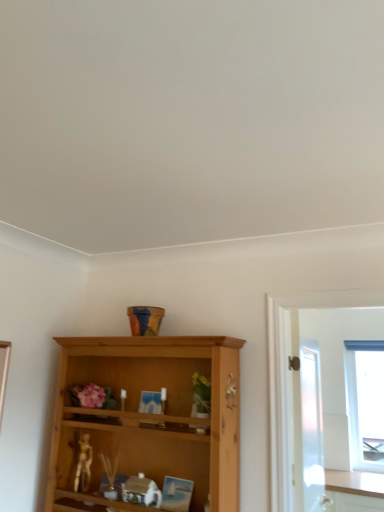
Question: Is white frosted glass screen door at right shorter than metallic gold figurine at lower left?

Choices:
 (A) no
 (B) yes

Answer: (A)

Question: Is white frosted glass screen door at right facing away from metallic gold figurine at lower left?

Choices:
 (A) yes
 (B) no

Answer: (A)

Question: Can you confirm if white frosted glass screen door at right is bigger than metallic gold figurine at lower left?

Choices:
 (A) yes
 (B) no

Answer: (A)

Question: Is white frosted glass screen door at right touching metallic gold figurine at lower left?

Choices:
 (A) no
 (B) yes

Answer: (A)

Question: From a real-world perspective, is white frosted glass screen door at right on metallic gold figurine at lower left?

Choices:
 (A) yes
 (B) no

Answer: (A)

Question: Considering the relative sizes of white frosted glass screen door at right and metallic gold figurine at lower left in the image provided, is white frosted glass screen door at right thinner than metallic gold figurine at lower left?

Choices:
 (A) yes
 (B) no

Answer: (A)

Question: Is transparent glass window at right wider than metallic gold figurine at lower left?

Choices:
 (A) yes
 (B) no

Answer: (A)

Question: Is transparent glass window at right bigger than metallic gold figurine at lower left?

Choices:
 (A) no
 (B) yes

Answer: (B)

Question: Would you say transparent glass window at right is outside metallic gold figurine at lower left?

Choices:
 (A) no
 (B) yes

Answer: (B)

Question: Could you tell me if transparent glass window at right is turned towards metallic gold figurine at lower left?

Choices:
 (A) no
 (B) yes

Answer: (A)

Question: Is transparent glass window at right next to metallic gold figurine at lower left and touching it?

Choices:
 (A) no
 (B) yes

Answer: (A)

Question: Is the depth of transparent glass window at right greater than that of metallic gold figurine at lower left?

Choices:
 (A) no
 (B) yes

Answer: (B)

Question: From the image's perspective, is metallic gold figurine at lower left above white frosted glass screen door at right?

Choices:
 (A) yes
 (B) no

Answer: (B)